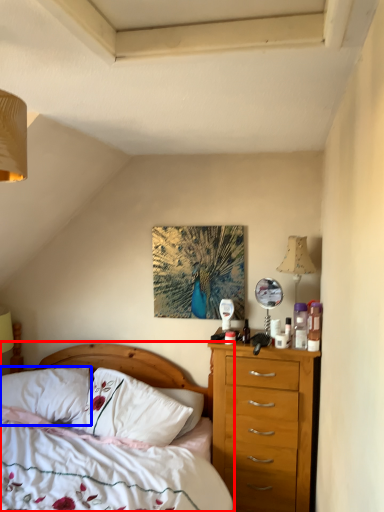
Question: Which point is further to the camera, bed (highlighted by a red box) or pillow (highlighted by a blue box)?

Choices:
 (A) bed
 (B) pillow

Answer: (B)